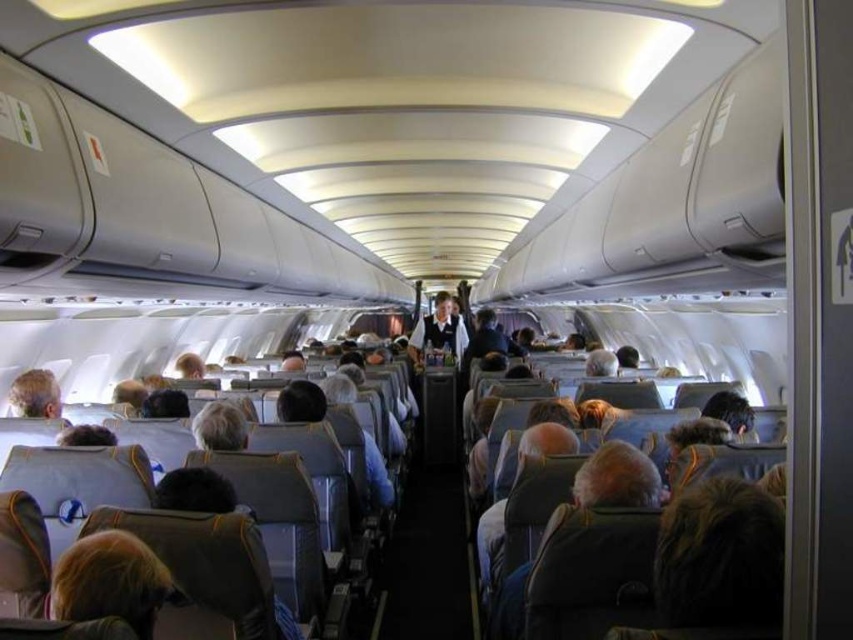
Is blonde hair at lower left above white shirt at center?

No, blonde hair at lower left is not above white shirt at center.

Is blonde hair at lower left to the right of white shirt at center from the viewer's perspective?

In fact, blonde hair at lower left is to the left of white shirt at center.

Identify the location of blonde hair at lower left. This screenshot has height=640, width=853. (109, 580).

From the picture: Between white shirt at center and light brown leather headrest at lower left, which one appears on the left side from the viewer's perspective?

light brown leather headrest at lower left

Is point (451, 317) positioned after point (51, 390)?

Yes.

Where is `white shirt at center`? This screenshot has height=640, width=853. white shirt at center is located at coordinates (438, 330).

Where is `white shirt at center`? white shirt at center is located at coordinates (438, 330).

This screenshot has width=853, height=640. What do you see at coordinates (109, 580) in the screenshot?
I see `blonde hair at lower left` at bounding box center [109, 580].

Locate an element on the screen. The image size is (853, 640). blonde hair at lower left is located at coordinates (109, 580).

Where is `blonde hair at lower left`? blonde hair at lower left is located at coordinates (109, 580).